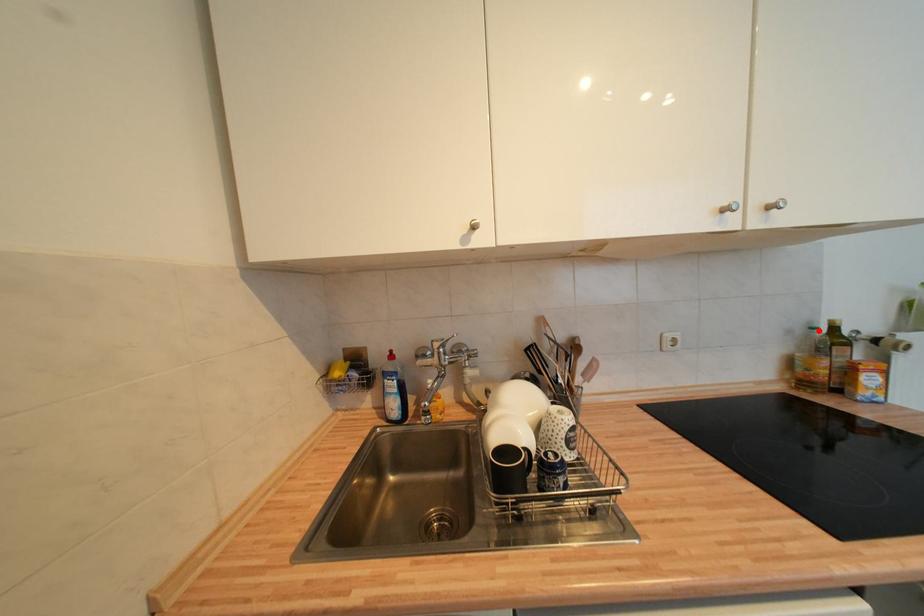
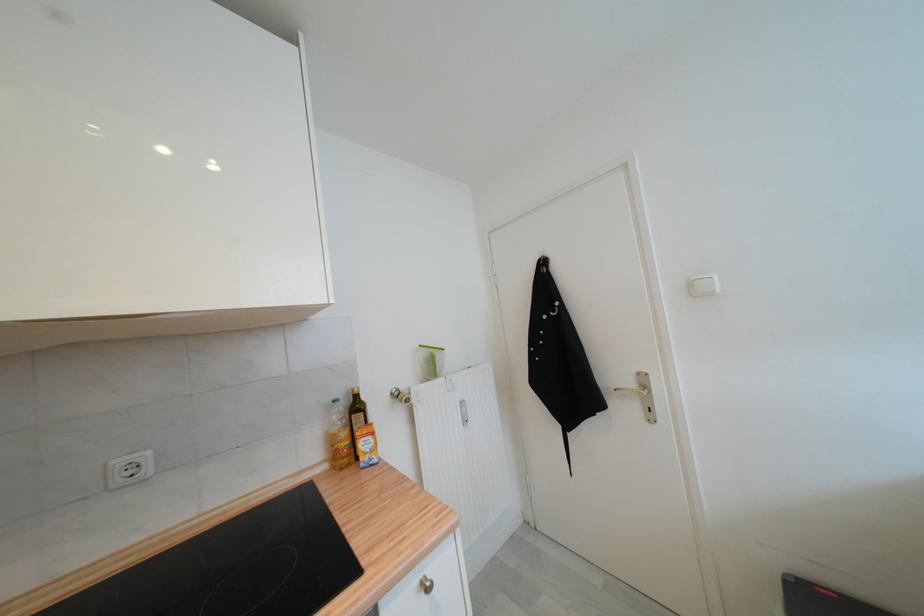
Locate, in the second image, the point that corresponds to the highlighted location in the first image.

(339, 403)